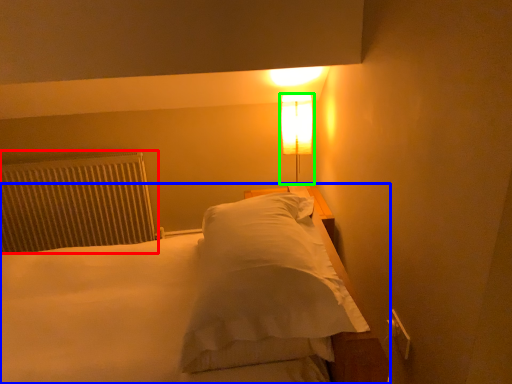
Question: Which is farther away from radiator (highlighted by a red box)? bed (highlighted by a blue box) or lamp (highlighted by a green box)?

Choices:
 (A) bed
 (B) lamp

Answer: (B)